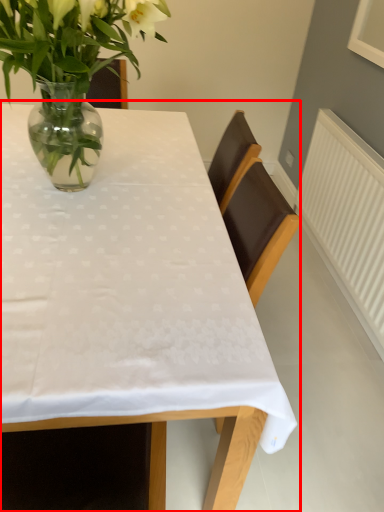
Question: Considering the relative positions of table (annotated by the red box) and houseplant in the image provided, where is table (annotated by the red box) located with respect to the staircase?

Choices:
 (A) right
 (B) left

Answer: (B)